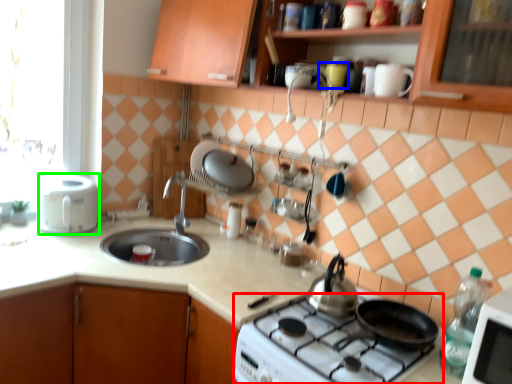
Question: Which object is positioned closest to gas stove (highlighted by a red box)? Select from mug (highlighted by a blue box) and kitchen appliance (highlighted by a green box).

Choices:
 (A) mug
 (B) kitchen appliance

Answer: (A)